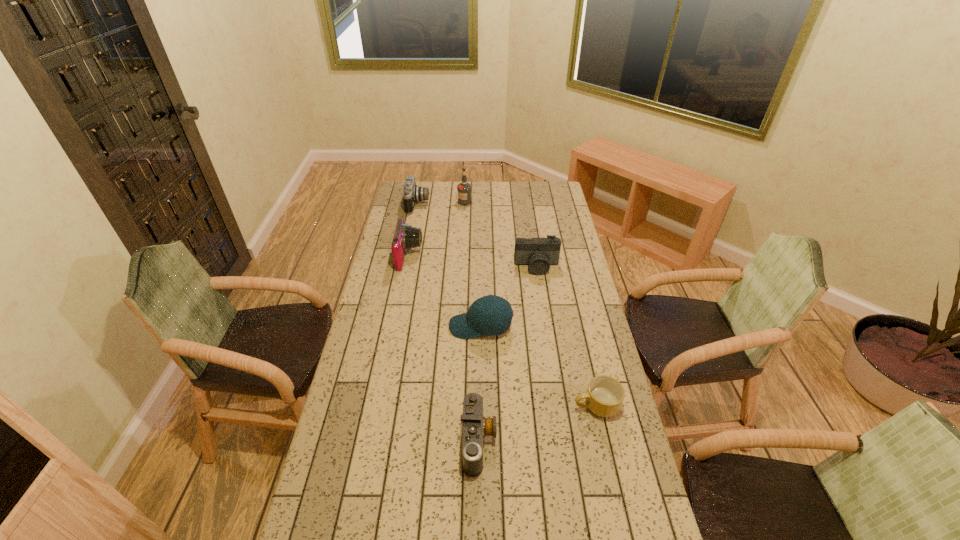
You are a GUI agent. You are given a task and a screenshot of the screen. Output one action in this format:
    pyautogui.click(x=<x>, y=<y>)
    Task: Click on the camera that is the second nearest to the shortest object
    Image resolution: width=960 pixels, height=540 pixels.
    Given the screenshot: What is the action you would take?
    pyautogui.click(x=538, y=253)

Select which camera appears as the third closest to the baseball cap. Please provide its 2D coordinates. Your answer should be formatted as a tuple, i.e. [(x, y)], where the tuple contains the x and y coordinates of a point satisfying the conditions above.

[(475, 427)]

I want to click on free space that satisfies the following two spatial constraints: 1. on the side with the handle of the shortest object; 2. on the front label of the vodka, so 550,201.

At what (x,y) coordinates should I click in order to perform the action: click on free spot that satisfies the following two spatial constraints: 1. at the lens of the rightmost camera; 2. on the lens of the nearest camera. Please return your answer as a coordinate pair (x, y). This screenshot has height=540, width=960. Looking at the image, I should click on (564, 441).

Locate an element on the screen. free space that satisfies the following two spatial constraints: 1. on the front-facing side of the farthest camera; 2. on the side with the handle of the mug is located at coordinates (377, 406).

Identify the location of free location that satisfies the following two spatial constraints: 1. at the lens of the rightmost camera; 2. on the side with the handle of the shortest object. The width and height of the screenshot is (960, 540). (558, 406).